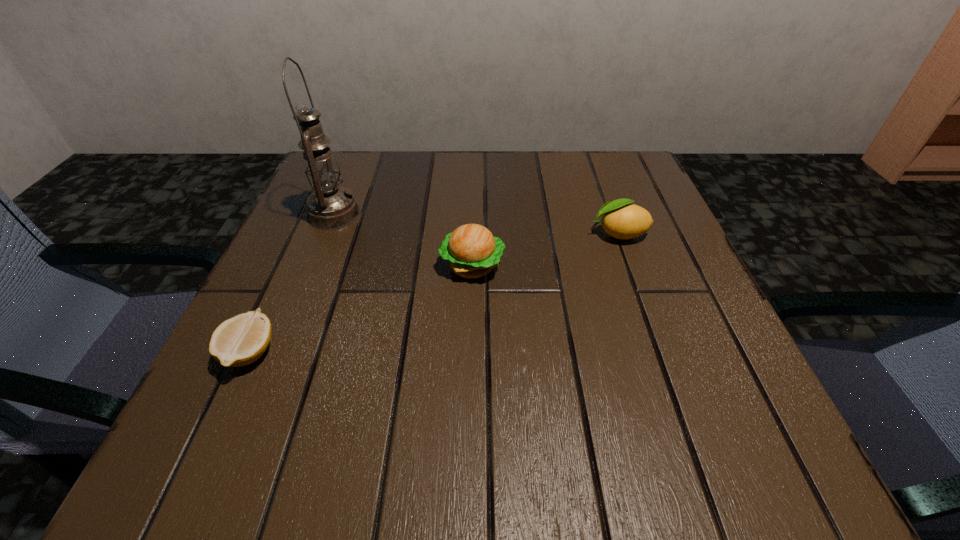
Where is `blank region between the hamburger and the tallest object`? Image resolution: width=960 pixels, height=540 pixels. blank region between the hamburger and the tallest object is located at coordinates (403, 240).

You are a GUI agent. You are given a task and a screenshot of the screen. Output one action in this format:
    pyautogui.click(x=<x>, y=<y>)
    Task: Click on the free space between the tallest object and the taller lemon
    
    Given the screenshot: What is the action you would take?
    pyautogui.click(x=476, y=224)

This screenshot has width=960, height=540. I want to click on object that is the third closest to the second nearest object, so [241, 340].

Image resolution: width=960 pixels, height=540 pixels. I want to click on object that is the third closest to the rightmost object, so tap(241, 340).

I want to click on vacant space that satisfies the following two spatial constraints: 1. with leaves positioned above the right lemon; 2. on the front side of the nearest object, so click(x=661, y=353).

This screenshot has width=960, height=540. I want to click on blank area in the image that satisfies the following two spatial constraints: 1. with leaves positioned above the taller lemon; 2. on the front side of the left lemon, so click(x=661, y=353).

Where is `free spot that satisfies the following two spatial constraints: 1. on the front side of the oil lamp; 2. on the left side of the second object from right to left`? This screenshot has height=540, width=960. free spot that satisfies the following two spatial constraints: 1. on the front side of the oil lamp; 2. on the left side of the second object from right to left is located at coordinates (313, 266).